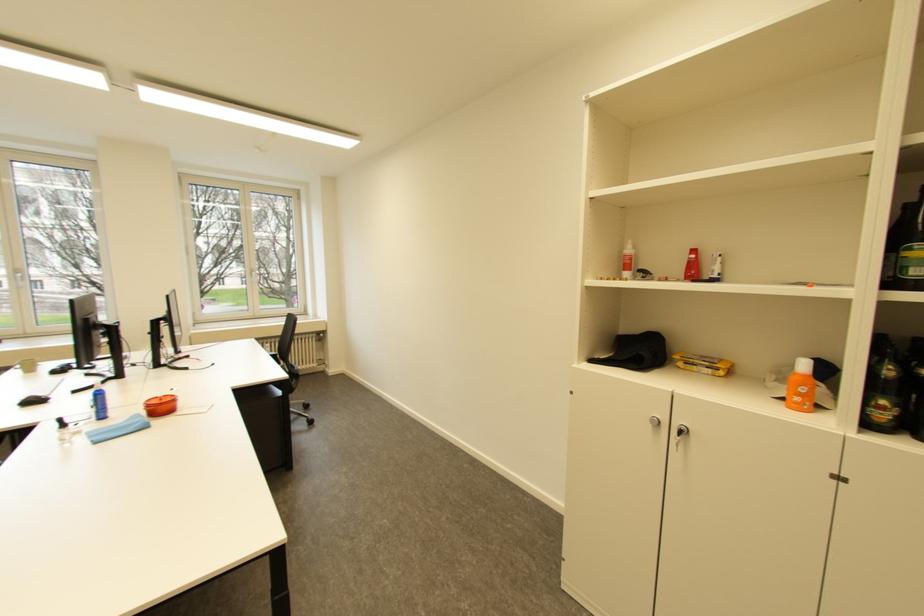
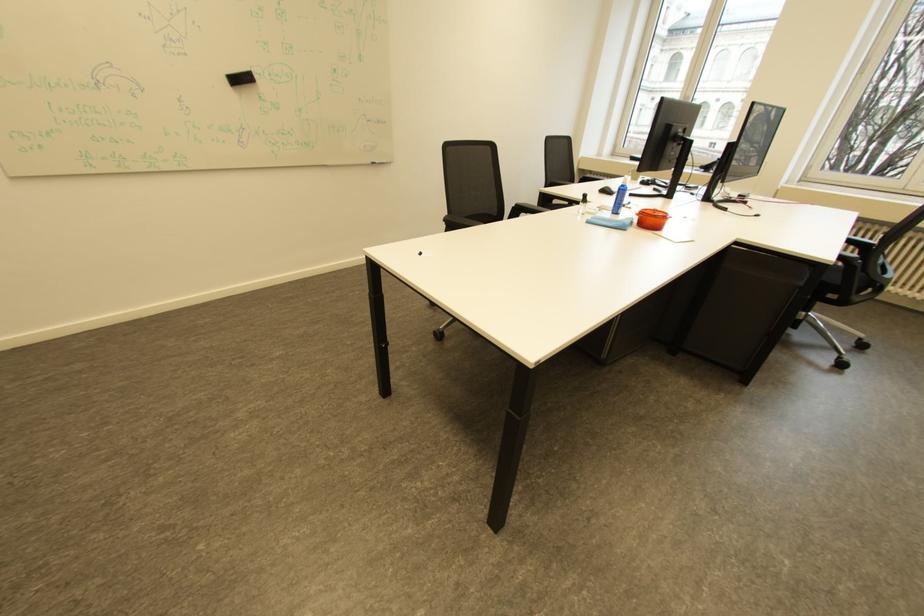
Where in the second image is the point corresponding to point 27,408 from the first image?

(608, 193)